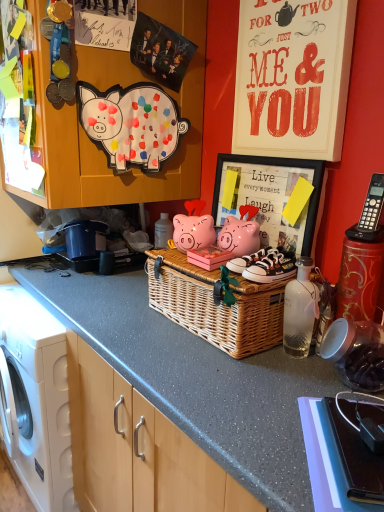
What are the coordinates of `free spot above black plastic phone at upper right (from a real-world perspective)` in the screenshot? It's located at (353, 439).